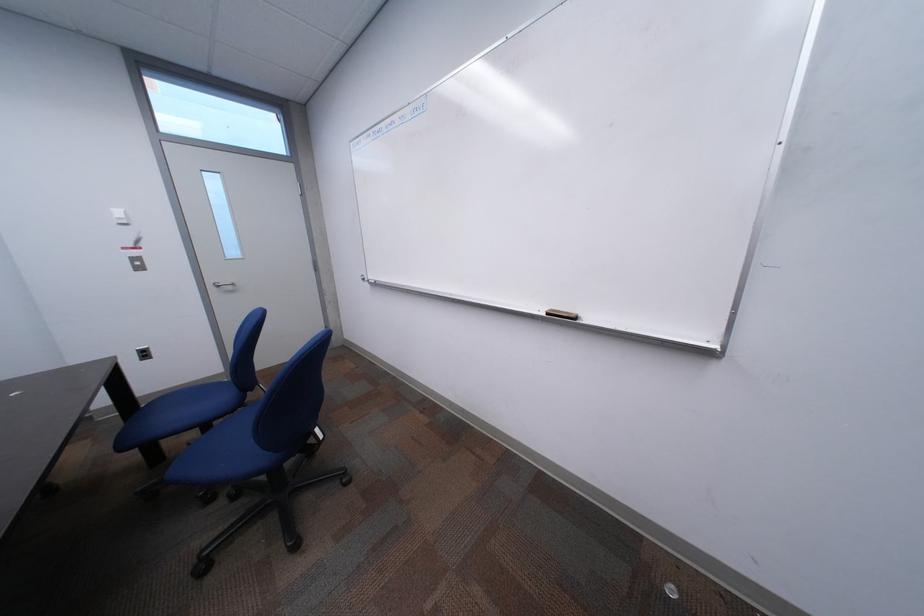
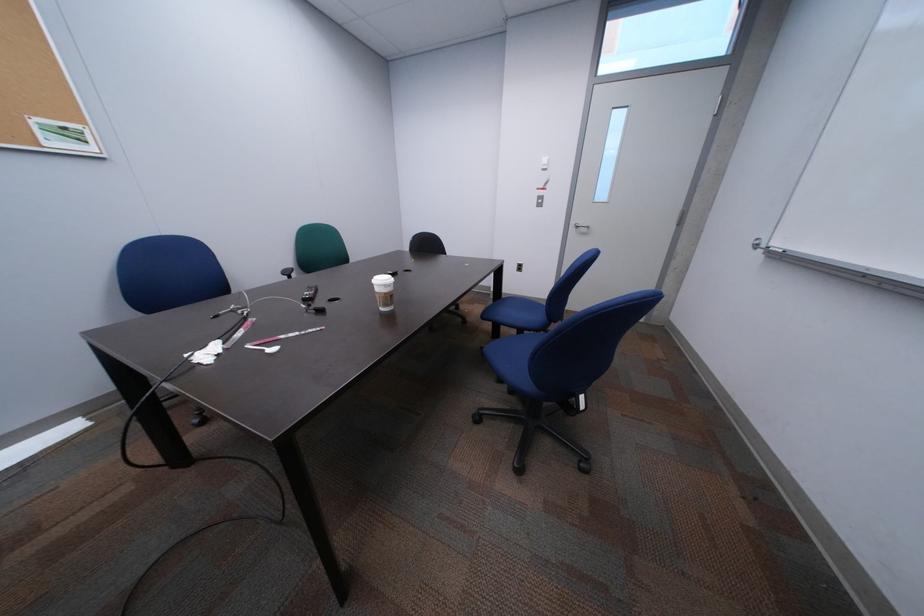
Based on the continuous images, in which direction is the camera rotating?

The rotation direction of the camera is left-down.